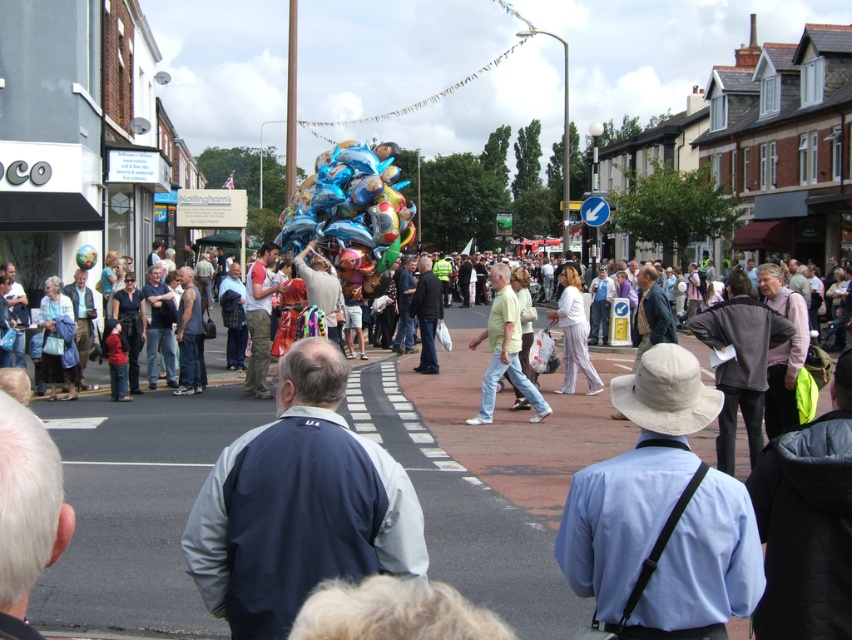
You are a child who wants to grab the multicolored balloons at center and the shiny metallic balloon at center. Which one is easier to reach if you can only reach up to your shoulder height?

The multicolored balloons at center is positioned under the shiny metallic balloon at center, so the multicolored balloons at center is easier to reach since it is lower than the shiny metallic balloon at center.

You are a photographer trying to capture both the dark blue jacket at center and the light blue shirt at center in a single frame. Given that your camera can only focus on objects within a 30 cm width, will both fit comfortably in the frame?

The dark blue jacket at center is wider than the light blue shirt at center. Since the camera can focus on objects within 30 cm width, both items can fit comfortably as their combined width would not exceed the limit.

You are a photographer trying to capture the vendor and the balloons in a single shot. Given that your camera frame can only accommodate objects taking up 60 units of space, will the dark blue jacket at center and the shiny metallic balloons at center both fit within the frame?

The dark blue jacket at center occupies less space than the shiny metallic balloons at center. Since the total space required would be the sum of both, and the balloons alone take up more than 60 units, they won t fit together.